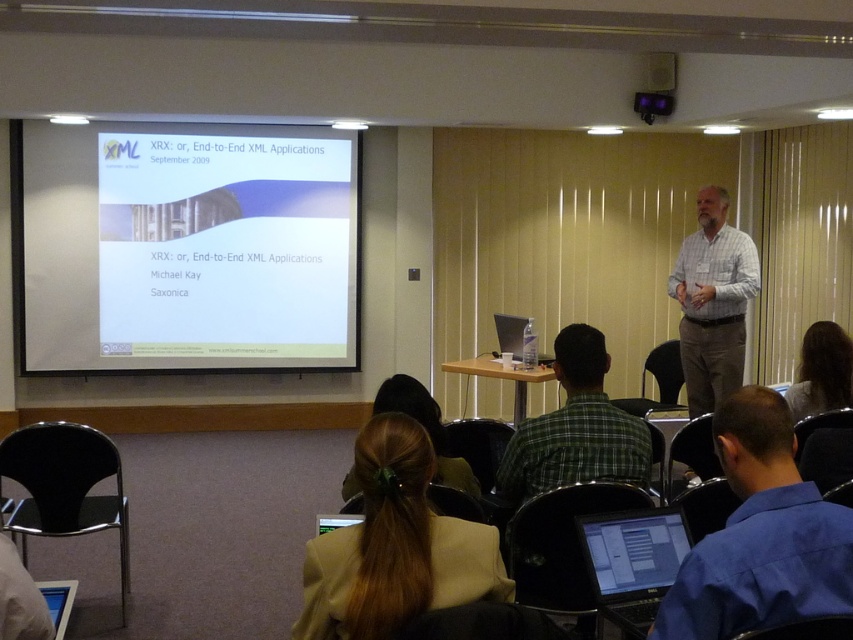
Which is behind, point (326, 356) or point (640, 96)?

Positioned behind is point (326, 356).

Which of these two, white matte projector screen at upper center or black plastic projector at upper center, stands shorter?

With less height is black plastic projector at upper center.

The width and height of the screenshot is (853, 640). I want to click on white matte projector screen at upper center, so click(x=187, y=248).

Can you confirm if white matte projector screen at upper center is positioned above plaid shirt at center?

Indeed, white matte projector screen at upper center is positioned over plaid shirt at center.

Does point (61, 268) come farther from viewer compared to point (692, 252)?

Yes, point (61, 268) is behind point (692, 252).

Identify the location of white matte projector screen at upper center. (187, 248).

Which of these two, brown hair at center or black plastic projector at upper center, stands shorter?

black plastic projector at upper center is shorter.

Which is below, brown hair at center or black plastic projector at upper center?

brown hair at center is lower down.

Where is `brown hair at center`? The width and height of the screenshot is (853, 640). brown hair at center is located at coordinates (425, 428).